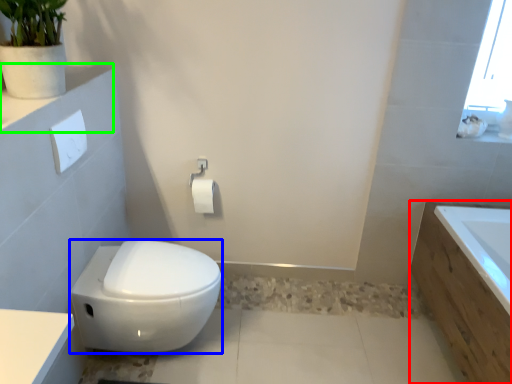
Question: Considering the real-world distances, which object is farthest from bath (highlighted by a red box)? bidet (highlighted by a blue box) or ledge (highlighted by a green box)?

Choices:
 (A) bidet
 (B) ledge

Answer: (B)